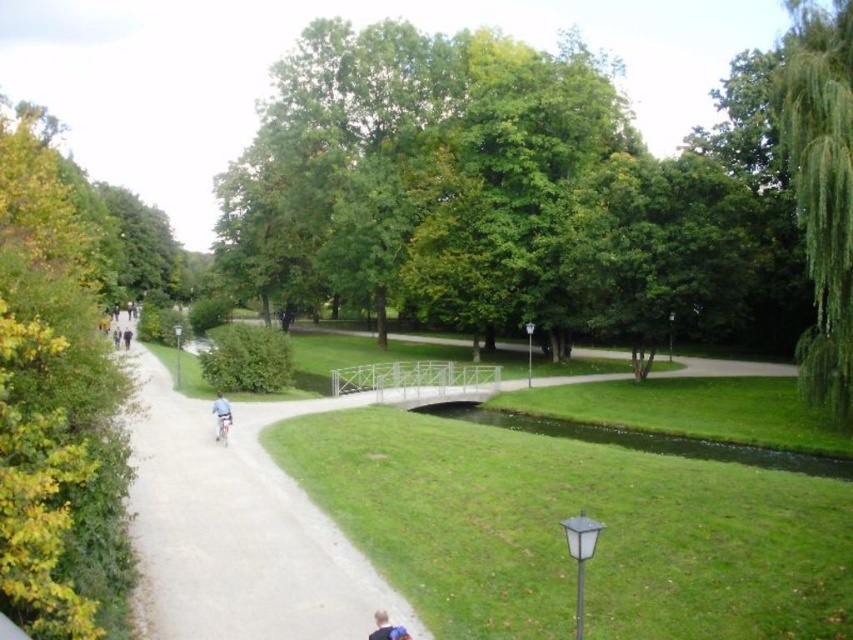
Which is behind, point (44, 212) or point (219, 433)?

The point (44, 212) is behind.

Can you confirm if green leafy tree at left is taller than light blue metallic bicycle at center?

Correct, green leafy tree at left is much taller as light blue metallic bicycle at center.

Is point (57, 312) farther from viewer compared to point (215, 419)?

No.

Locate an element on the screen. The width and height of the screenshot is (853, 640). green leafy tree at left is located at coordinates (56, 401).

Who is positioned more to the right, green leafy tree at left or green leafy tree at upper right?

Positioned to the right is green leafy tree at upper right.

How far apart are green leafy tree at left and green leafy tree at upper right?

green leafy tree at left is 26.09 meters away from green leafy tree at upper right.

Which is behind, point (55, 563) or point (820, 58)?

Point (820, 58)

I want to click on green leafy tree at left, so click(x=56, y=401).

Is green leafy tree at upper right further to camera compared to blue fabric shirt at center?

No.

Identify the location of green leafy tree at upper right. (821, 188).